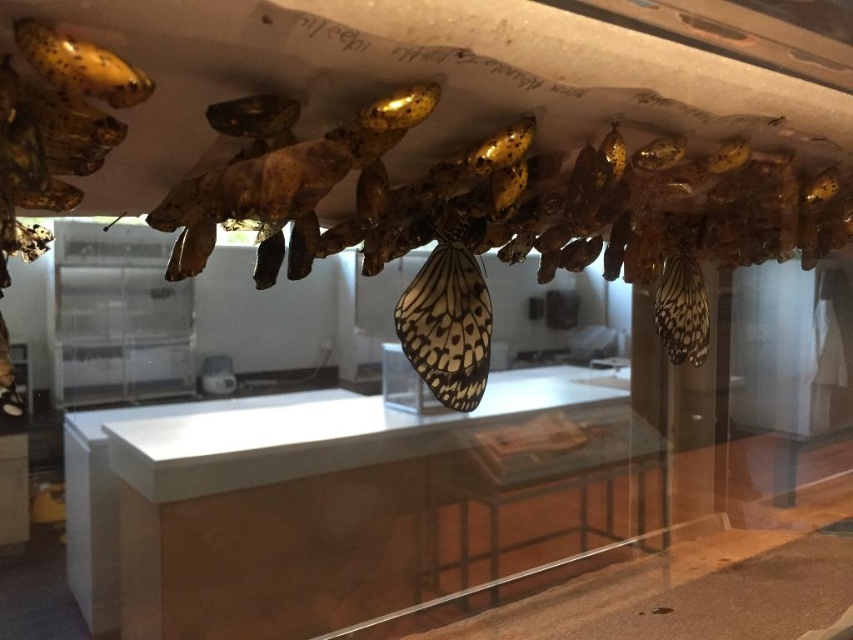
Question: Estimate the real-world distances between objects in this image. Which object is closer to the white glossy counter top at center?

Choices:
 (A) patterned paper butterfly at center
 (B) translucent white butterfly at center

Answer: (B)

Question: Can you confirm if patterned paper butterfly at center is smaller than translucent white butterfly at center?

Choices:
 (A) yes
 (B) no

Answer: (A)

Question: Which point is closer to the camera taking this photo?

Choices:
 (A) (664, 323)
 (B) (415, 296)
 (C) (386, 528)

Answer: (B)

Question: Which point is closer to the camera?

Choices:
 (A) (488, 332)
 (B) (262, 561)

Answer: (A)

Question: Does white glossy counter top at center have a lesser width compared to patterned paper butterfly at center?

Choices:
 (A) no
 (B) yes

Answer: (A)

Question: Can you confirm if white glossy counter top at center is smaller than patterned paper butterfly at center?

Choices:
 (A) no
 (B) yes

Answer: (A)